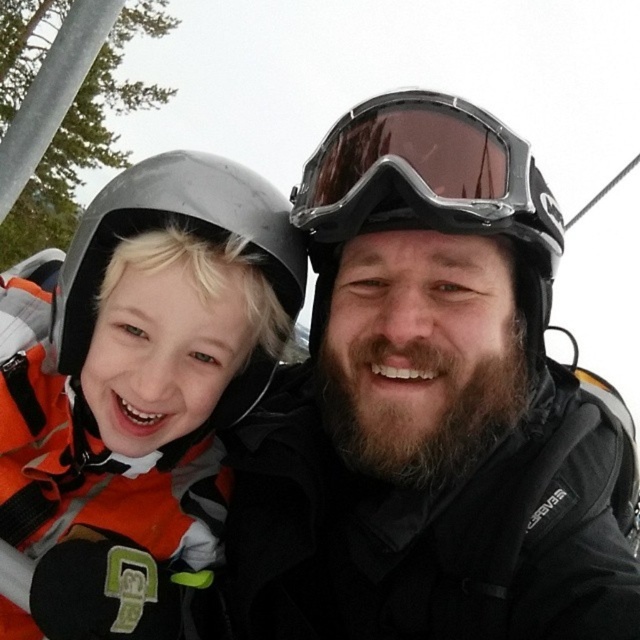
Question: Does black matte helmet at upper center come in front of matte black helmet at left?

Choices:
 (A) no
 (B) yes

Answer: (B)

Question: Which of these objects is positioned farthest from the black matte helmet at upper center?

Choices:
 (A) matte black helmet at left
 (B) transparent plastic goggles at center

Answer: (A)

Question: Can you confirm if black matte helmet at upper center is bigger than matte black helmet at left?

Choices:
 (A) no
 (B) yes

Answer: (B)

Question: Which point is closer to the camera?

Choices:
 (A) (257, 556)
 (B) (305, 211)
 (C) (36, 445)

Answer: (B)

Question: Can you confirm if black matte helmet at upper center is smaller than matte black helmet at left?

Choices:
 (A) no
 (B) yes

Answer: (A)

Question: Which object is the closest to the matte black helmet at left?

Choices:
 (A) black matte helmet at upper center
 (B) transparent plastic goggles at center

Answer: (A)